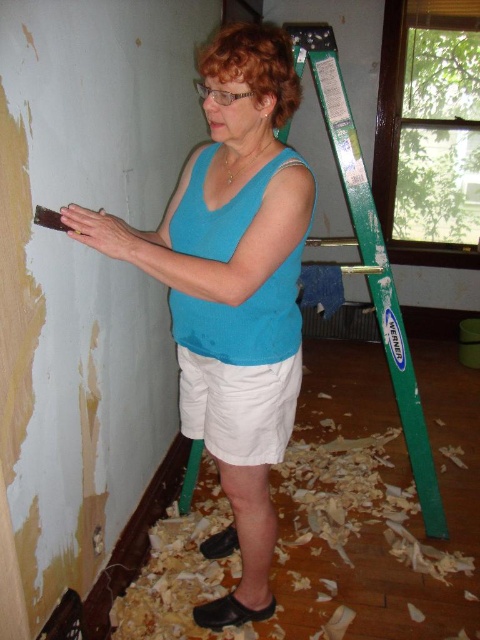
You are a painter who needs to paint the wall after the wallpaper is removed. You have two points marked on the wall where you want to place your paint cans. The points are at coordinates point [166,282] and point [192,410]. Which point is closer to you so you can easily reach it without moving?

Point [166,282] is closer to the camera than point [192,410], so you can easily reach it without moving.

You are a home renovation assistant. You see the wooden shavings at lower center and the white cotton shorts at center. Which object is located below the other?

The wooden shavings at lower center is positioned under the white cotton shorts at center.